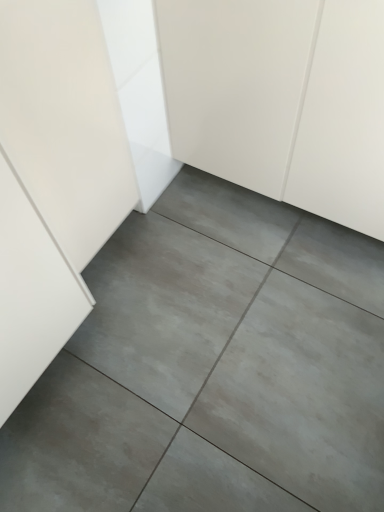
Image resolution: width=384 pixels, height=512 pixels. What do you see at coordinates (281, 99) in the screenshot? I see `white matte cabinet at center` at bounding box center [281, 99].

This screenshot has width=384, height=512. Identify the location of white matte cabinet at center. (281, 99).

What do you see at coordinates (213, 367) in the screenshot? I see `gray concrete floor at center` at bounding box center [213, 367].

In order to click on gray concrete floor at center in this screenshot , I will do `click(213, 367)`.

Where is `white matte cabinet at center`? The width and height of the screenshot is (384, 512). white matte cabinet at center is located at coordinates (281, 99).

Considering the relative positions of white matte cabinet at center and gray concrete floor at center in the image provided, is white matte cabinet at center to the left of gray concrete floor at center from the viewer's perspective?

In fact, white matte cabinet at center is to the right of gray concrete floor at center.

Looking at this image, does white matte cabinet at center come in front of gray concrete floor at center?

Yes, white matte cabinet at center is in front of gray concrete floor at center.

Is point (241, 78) positioned before point (167, 356)?

Yes, point (241, 78) is closer to viewer.

From the image's perspective, is white matte cabinet at center above or below gray concrete floor at center?

Clearly, from the image's perspective, white matte cabinet at center is above gray concrete floor at center.

From a real-world perspective, is white matte cabinet at center on gray concrete floor at center?

Yes, from a real-world perspective, white matte cabinet at center is on top of gray concrete floor at center.

In terms of width, does white matte cabinet at center look wider or thinner when compared to gray concrete floor at center?

white matte cabinet at center is thinner than gray concrete floor at center.

In terms of height, does white matte cabinet at center look taller or shorter compared to gray concrete floor at center?

Clearly, white matte cabinet at center is taller compared to gray concrete floor at center.

Does white matte cabinet at center have a larger size compared to gray concrete floor at center?

Yes.

Is white matte cabinet at center inside or outside of gray concrete floor at center?

white matte cabinet at center cannot be found inside gray concrete floor at center.

Is white matte cabinet at center with gray concrete floor at center?

No, white matte cabinet at center is not beside gray concrete floor at center.

Is white matte cabinet at center oriented away from gray concrete floor at center?

No, white matte cabinet at center is not facing away from gray concrete floor at center.

How many degrees apart are the facing directions of white matte cabinet at center and gray concrete floor at center?

There is a 0.293-degree angle between the facing directions of white matte cabinet at center and gray concrete floor at center.

Locate an element on the screen. The width and height of the screenshot is (384, 512). concrete that is on the left side of white matte cabinet at center is located at coordinates (213, 367).

Between gray concrete floor at center and white matte cabinet at center, which one appears on the left side from the viewer's perspective?

gray concrete floor at center is more to the left.

Considering their positions, is gray concrete floor at center located in front of or behind white matte cabinet at center?

Clearly, gray concrete floor at center is behind white matte cabinet at center.

Does point (156, 409) appear closer or farther from the camera than point (325, 164)?

Point (156, 409) is positioned closer to the camera compared to point (325, 164).

From the image's perspective, would you say gray concrete floor at center is shown under white matte cabinet at center?

Correct, gray concrete floor at center appears lower than white matte cabinet at center in the image.

From a real-world perspective, is gray concrete floor at center above or below white matte cabinet at center?

gray concrete floor at center is situated lower than white matte cabinet at center in the real world.

In terms of width, does gray concrete floor at center look wider or thinner when compared to white matte cabinet at center?

Considering their sizes, gray concrete floor at center looks broader than white matte cabinet at center.

Who is taller, gray concrete floor at center or white matte cabinet at center?

With more height is white matte cabinet at center.

Who is smaller, gray concrete floor at center or white matte cabinet at center?

gray concrete floor at center is smaller.

Is white matte cabinet at center located within gray concrete floor at center?

No.

Would you say gray concrete floor at center is a long distance from white matte cabinet at center?

No.

Is gray concrete floor at center turned away from white matte cabinet at center?

No, white matte cabinet at center is not at the back of gray concrete floor at center.

How different are the orientations of gray concrete floor at center and white matte cabinet at center in degrees?

The angular difference between gray concrete floor at center and white matte cabinet at center is 0.293 degrees.

The width and height of the screenshot is (384, 512). I want to click on concrete that appears below the white matte cabinet at center (from a real-world perspective), so click(213, 367).

I want to click on cabinetry located on the right of gray concrete floor at center, so click(281, 99).

Locate an element on the screen. The image size is (384, 512). concrete below the white matte cabinet at center (from the image's perspective) is located at coordinates (213, 367).